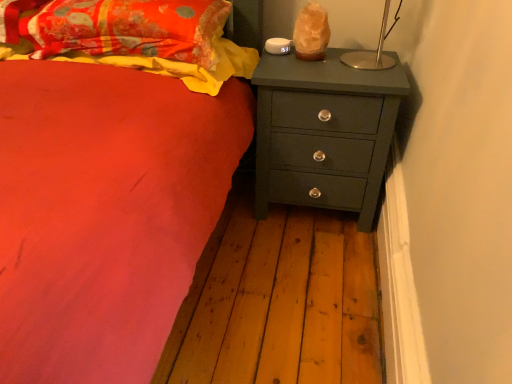
Question: Is floral fabric pillow at upper left to the left of matte dark green chest of drawers at right from the viewer's perspective?

Choices:
 (A) yes
 (B) no

Answer: (A)

Question: Can you confirm if floral fabric pillow at upper left is thinner than matte dark green chest of drawers at right?

Choices:
 (A) yes
 (B) no

Answer: (A)

Question: Is floral fabric pillow at upper left smaller than matte dark green chest of drawers at right?

Choices:
 (A) yes
 (B) no

Answer: (A)

Question: Is floral fabric pillow at upper left shorter than matte dark green chest of drawers at right?

Choices:
 (A) no
 (B) yes

Answer: (B)

Question: From the image's perspective, would you say floral fabric pillow at upper left is positioned over matte dark green chest of drawers at right?

Choices:
 (A) no
 (B) yes

Answer: (B)

Question: Considering the positions of matte dark green chest of drawers at right and floral fabric pillow at upper left in the image, is matte dark green chest of drawers at right taller or shorter than floral fabric pillow at upper left?

Choices:
 (A) short
 (B) tall

Answer: (B)

Question: Visually, is matte dark green chest of drawers at right positioned to the left or to the right of floral fabric pillow at upper left?

Choices:
 (A) right
 (B) left

Answer: (A)

Question: Looking at the image, does matte dark green chest of drawers at right seem bigger or smaller compared to floral fabric pillow at upper left?

Choices:
 (A) small
 (B) big

Answer: (B)

Question: Looking at their shapes, would you say matte dark green chest of drawers at right is wider or thinner than floral fabric pillow at upper left?

Choices:
 (A) wide
 (B) thin

Answer: (A)

Question: Is fluffy cotton blanket at upper left taller or shorter than matte dark green chest of drawers at right?

Choices:
 (A) tall
 (B) short

Answer: (B)

Question: In the image, is fluffy cotton blanket at upper left on the left side or the right side of matte dark green chest of drawers at right?

Choices:
 (A) right
 (B) left

Answer: (B)

Question: Considering the positions of point (138, 62) and point (260, 190), is point (138, 62) closer or farther from the camera than point (260, 190)?

Choices:
 (A) farther
 (B) closer

Answer: (B)

Question: From the image's perspective, is fluffy cotton blanket at upper left positioned above or below matte dark green chest of drawers at right?

Choices:
 (A) above
 (B) below

Answer: (A)

Question: From a real-world perspective, is fluffy cotton blanket at upper left above or below floral fabric pillow at upper left?

Choices:
 (A) above
 (B) below

Answer: (B)

Question: In the image, is fluffy cotton blanket at upper left on the left side or the right side of floral fabric pillow at upper left?

Choices:
 (A) right
 (B) left

Answer: (A)